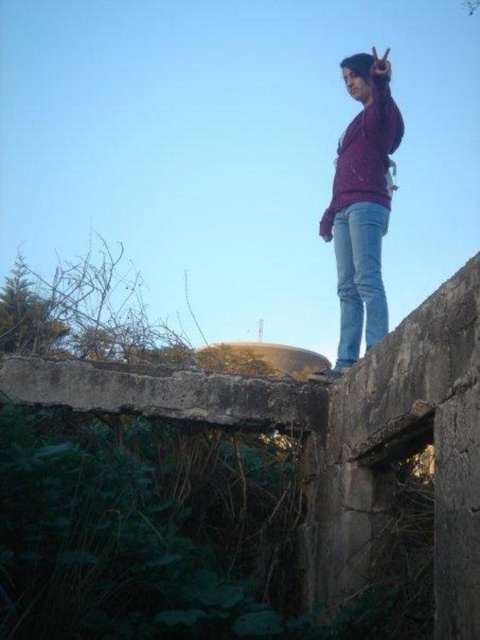
You are a photographer trying to capture the purple matte sweater at upper center in your shot. The camera you are using has a rectangular viewfinder with coordinates ranging from 0 to 1 on both the x and y axes. The sweater must be centered precisely at the viewfinder point 0.320, 0.754 to ensure optimal focus. Can you confirm if the sweater is positioned correctly within the viewfinder?

The purple matte sweater at upper center is located exactly at the point (361, 204), so it is perfectly centered in the viewfinder for optimal focus.

You are a fashion designer observing the scene. You notice the purple matte sweater at upper center and the matte purple sweatshirt at center. Which one would you suggest to a client who prefers a more compact and less bulky look?

The purple matte sweater at upper center has a smaller size compared to the matte purple sweatshirt at center, so it would be the better suggestion for a client preferring a compact and less bulky look.

You are a photographer trying to capture the purple matte sweater at upper center and the jeans at upper right in a single frame. Based on their positions, which object should you adjust your camera to focus on first to ensure both are in the shot?

The purple matte sweater at upper center should be focused on first since it is positioned to the left of the jeans at upper right, allowing the photographer to frame both objects by centering the camera between them.